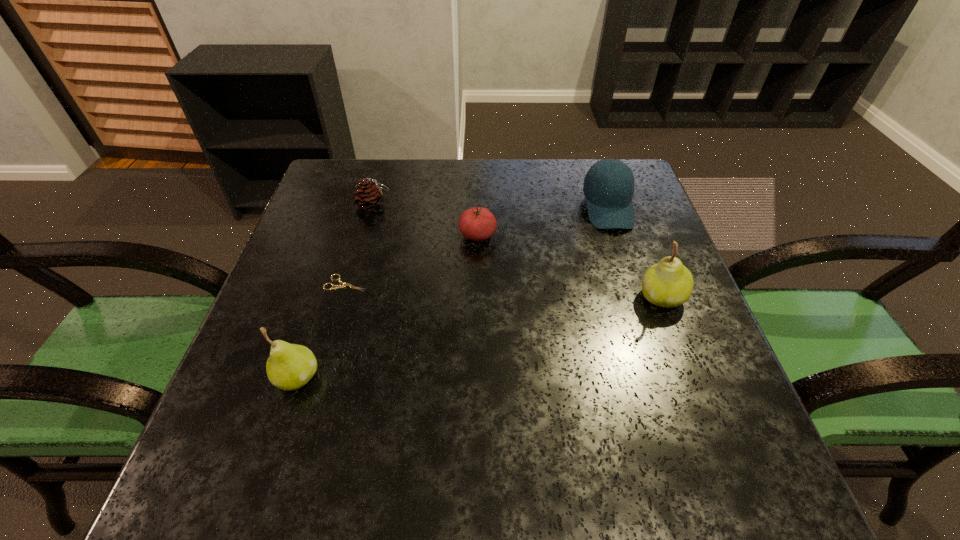
Identify the location of vacant space at the near left corner of the desktop. The height and width of the screenshot is (540, 960). (299, 424).

In the image, there is a desktop. Where is `vacant space at the near right corner`? vacant space at the near right corner is located at coordinates tap(703, 410).

Find the location of `empty location between the shears and the nearest object`. empty location between the shears and the nearest object is located at coordinates (322, 330).

Where is `free space between the left pear and the shortest object`? Image resolution: width=960 pixels, height=540 pixels. free space between the left pear and the shortest object is located at coordinates tap(322, 330).

Image resolution: width=960 pixels, height=540 pixels. Identify the location of vacant area that lies between the left pear and the taller pear. (479, 337).

Find the location of `unoccupied position between the fourth object from left to right and the shears`. unoccupied position between the fourth object from left to right and the shears is located at coordinates (412, 260).

The height and width of the screenshot is (540, 960). What are the coordinates of `free space between the farther pear and the tomato` in the screenshot? It's located at (569, 267).

Where is `free space between the right pear and the pinecone`? This screenshot has height=540, width=960. free space between the right pear and the pinecone is located at coordinates (517, 252).

Where is `free space between the third tallest object and the taller pear`? This screenshot has height=540, width=960. free space between the third tallest object and the taller pear is located at coordinates (x=635, y=253).

The width and height of the screenshot is (960, 540). Identify the location of vacant space that's between the baseball cap and the taller pear. 635,253.